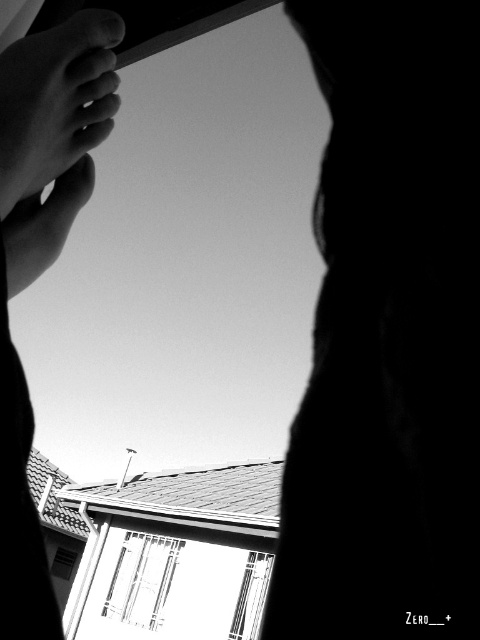
Question: Which point is closer to the camera?

Choices:
 (A) clear glass window at center
 (B) matte skin at upper left

Answer: (B)

Question: Does matte skin at upper left come in front of metallic glass window at lower center?

Choices:
 (A) yes
 (B) no

Answer: (A)

Question: Among these points, which one is nearest to the camera?

Choices:
 (A) (34, 154)
 (B) (120, 563)
 (C) (240, 596)

Answer: (A)

Question: Which point is farther to the camera?

Choices:
 (A) pos(233,630)
 (B) pos(153,573)
 (C) pos(9,128)

Answer: (B)

Question: Can you confirm if clear glass window at center is positioned below metallic glass window at lower center?

Choices:
 (A) yes
 (B) no

Answer: (A)

Question: Is clear glass window at center smaller than metallic glass window at lower center?

Choices:
 (A) no
 (B) yes

Answer: (A)